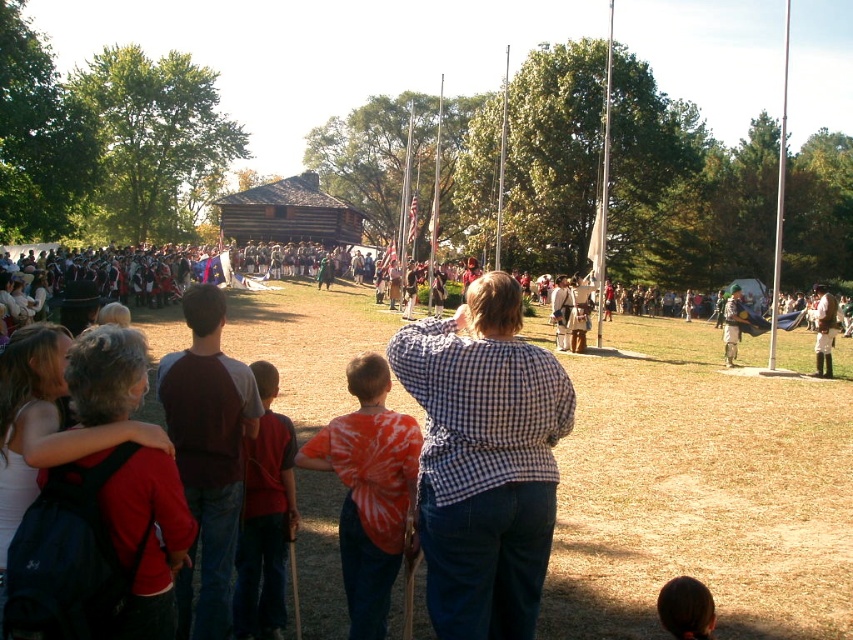
Question: Is red tie-dye shirt at center further to the viewer compared to brown leather boots at lower right?

Choices:
 (A) yes
 (B) no

Answer: (B)

Question: Does red tie-dye shirt at center come in front of brown leather boots at lower right?

Choices:
 (A) no
 (B) yes

Answer: (B)

Question: Among these objects, which one is nearest to the camera?

Choices:
 (A) tie-dye shirt at center
 (B) checkered fabric shirt at center
 (C) red tie-dye shirt at center

Answer: (B)

Question: Based on their relative distances, which object is farther from the brown leather boots at lower right?

Choices:
 (A) brown cotton shirt at center
 (B) white fabric flagpole at center
 (C) dark brown hair at lower right

Answer: (B)

Question: Which of these objects is positioned farthest from the white fabric flagpole at center?

Choices:
 (A) checkered fabric shirt at center
 (B) brown leather boots at lower right
 (C) brown dry grass at center

Answer: (A)

Question: Is checkered fabric shirt at center above metallic pole at right?

Choices:
 (A) no
 (B) yes

Answer: (A)